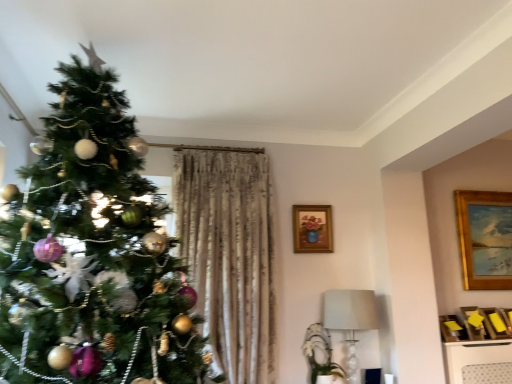
Question: From the image's perspective, is white fabric lampshade at lower right positioned above or below shiny metallic ornaments at left?

Choices:
 (A) above
 (B) below

Answer: (B)

Question: Looking at the image, does white fabric lampshade at lower right seem bigger or smaller compared to shiny metallic ornaments at left?

Choices:
 (A) big
 (B) small

Answer: (B)

Question: Which of these objects is positioned farthest from the white fabric lampshade at lower right?

Choices:
 (A) shiny metallic ornaments at left
 (B) wooden frame with floral painting at upper center, placed as the 2th picture frame when sorted from right to left
 (C) gold wooden picture frame at upper right, marked as the second picture frame in a left-to-right arrangement

Answer: (A)

Question: Estimate the real-world distances between objects in this image. Which object is farther from the gold wooden picture frame at upper right, which is counted as the first picture frame, starting from the back?

Choices:
 (A) white fabric lampshade at lower right
 (B) wooden frame with floral painting at upper center, the 1th picture frame in the left-to-right sequence
 (C) shiny metallic ornaments at left

Answer: (C)